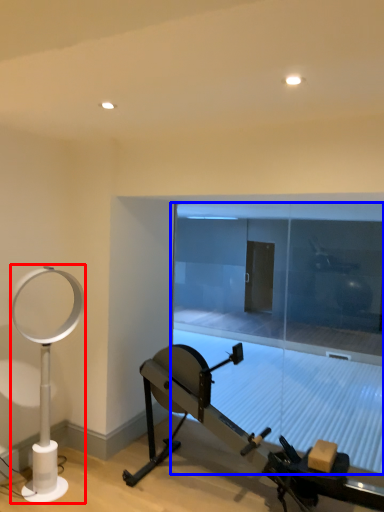
Question: Which object appears farthest to the camera in this image, table lamp (highlighted by a red box) or glass door (highlighted by a blue box)?

Choices:
 (A) table lamp
 (B) glass door

Answer: (B)